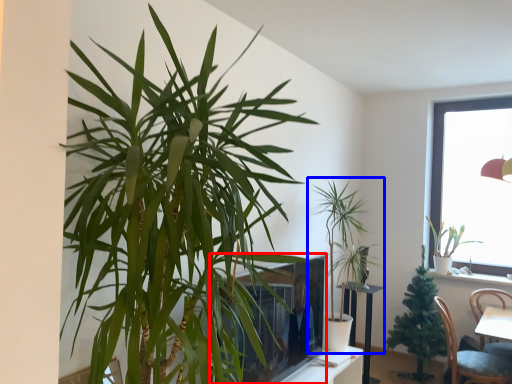
Question: Which of the following is the closest to the observer, window screen (highlighted by a red box) or houseplant (highlighted by a blue box)?

Choices:
 (A) window screen
 (B) houseplant

Answer: (A)